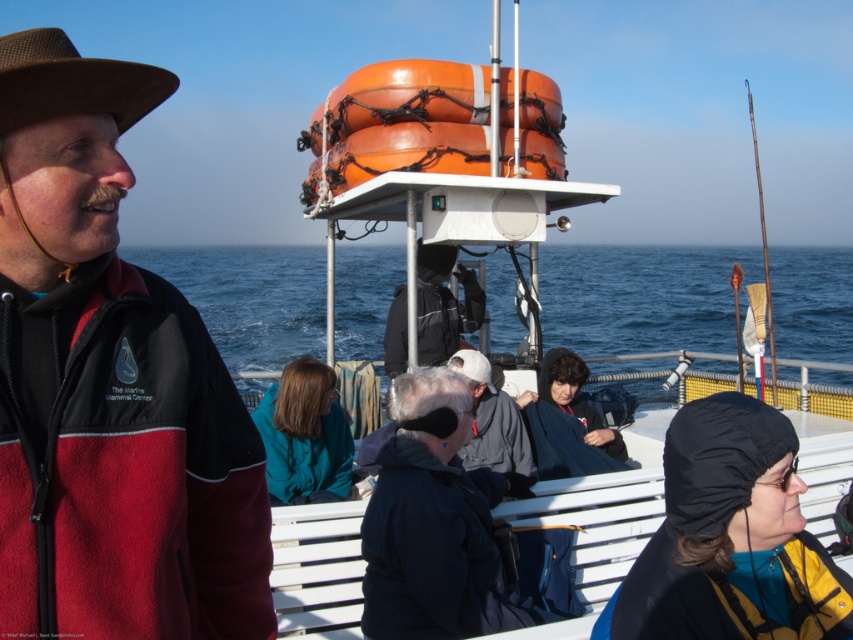
Is blue water at center smaller than black fabric backpack at center?

Incorrect, blue water at center is not smaller in size than black fabric backpack at center.

Is blue water at center thinner than black fabric backpack at center?

No, blue water at center is not thinner than black fabric backpack at center.

Is point (732, 250) positioned behind point (404, 323)?

Yes, point (732, 250) is farther from viewer.

The height and width of the screenshot is (640, 853). Find the location of `blue water at center`. blue water at center is located at coordinates (641, 298).

Between blue water at center and brown felt cowboy hat at left, which one has less height?

A: Standing shorter between the two is brown felt cowboy hat at left.

In the scene shown: Between blue water at center and brown felt cowboy hat at left, which one is positioned higher?

Positioned higher is blue water at center.

Measure the distance between point [318,256] and camera.

A distance of 83.44 meters exists between point [318,256] and camera.

This screenshot has height=640, width=853. In order to click on blue water at center in this screenshot , I will do `click(641, 298)`.

Who is positioned more to the left, brown fleece jacket at left or dark blue jacket at center?

From the viewer's perspective, brown fleece jacket at left appears more on the left side.

The width and height of the screenshot is (853, 640). I want to click on brown fleece jacket at left, so click(108, 387).

Does point (222, 564) come behind point (433, 552)?

No, (222, 564) is closer to viewer.

Identify the location of brown fleece jacket at left. (108, 387).